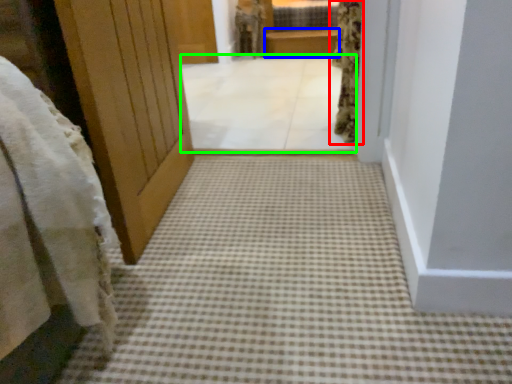
Question: Considering the real-world distances, which object is closest to curtain (highlighted by a red box)? balustrade (highlighted by a blue box) or corridor (highlighted by a green box).

Choices:
 (A) balustrade
 (B) corridor

Answer: (B)